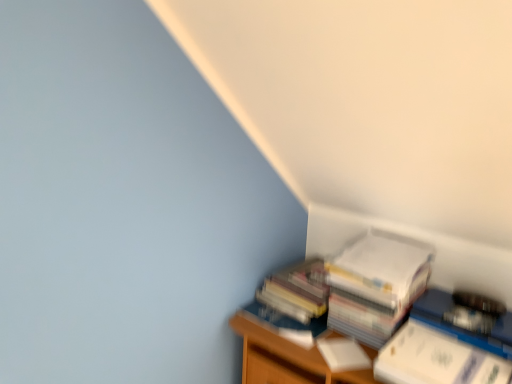
Question: Is the depth of white paper stack at lower right less than that of white matte paperback book at lower right, which is the 2th paperback book from back to front?

Choices:
 (A) no
 (B) yes

Answer: (A)

Question: Is white paper stack at lower right to the right of white matte paperback book at lower right, which is the 2th paperback book from back to front, from the viewer's perspective?

Choices:
 (A) no
 (B) yes

Answer: (A)

Question: From the image's perspective, is white paper stack at lower right over white matte paperback book at lower right, placed as the second paperback book when sorted from front to back?

Choices:
 (A) no
 (B) yes

Answer: (B)

Question: Can you confirm if white paper stack at lower right is taller than white matte paperback book at lower right, which is the 2th paperback book from back to front?

Choices:
 (A) yes
 (B) no

Answer: (A)

Question: Is white matte paperback book at lower right, placed as the second paperback book when sorted from front to back, inside white paper stack at lower right?

Choices:
 (A) yes
 (B) no

Answer: (B)

Question: Is white paper stack at lower right not close to white matte paperback book at lower right, placed as the second paperback book when sorted from front to back?

Choices:
 (A) no
 (B) yes

Answer: (A)

Question: Considering the relative positions of white paper at right, positioned as the first paperback book in front-to-back order, and wooden bookshelf at lower right in the image provided, is white paper at right, positioned as the first paperback book in front-to-back order, behind wooden bookshelf at lower right?

Choices:
 (A) no
 (B) yes

Answer: (A)

Question: Is white paper at right, the 3th paperback book in the back-to-front sequence, thinner than wooden bookshelf at lower right?

Choices:
 (A) yes
 (B) no

Answer: (A)

Question: Is white paper at right, positioned as the first paperback book in front-to-back order, facing towards wooden bookshelf at lower right?

Choices:
 (A) yes
 (B) no

Answer: (B)

Question: From the image's perspective, is white paper at right, the 3th paperback book in the back-to-front sequence, located above wooden bookshelf at lower right?

Choices:
 (A) no
 (B) yes

Answer: (B)

Question: Does white paper at right, positioned as the first paperback book in front-to-back order, come in front of wooden bookshelf at lower right?

Choices:
 (A) yes
 (B) no

Answer: (A)

Question: Can we say white paper at right, positioned as the first paperback book in front-to-back order, lies outside wooden bookshelf at lower right?

Choices:
 (A) yes
 (B) no

Answer: (A)

Question: Is white paper at upper right, which is the 3th paperback book from front to back, outside of white paper at right, the 3th paperback book in the back-to-front sequence?

Choices:
 (A) yes
 (B) no

Answer: (A)